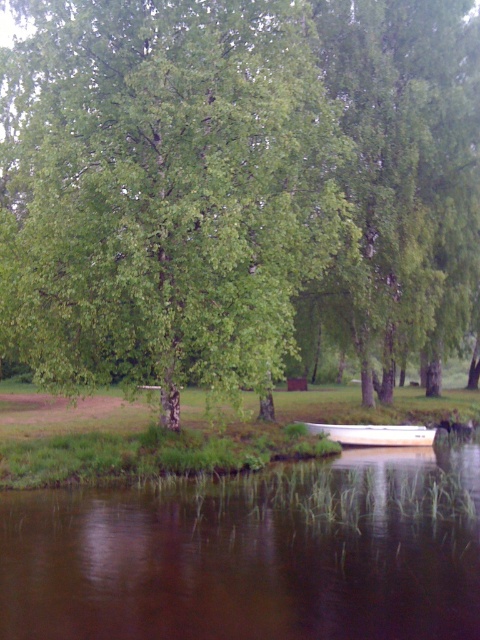
Question: Which of the following is the farthest from the observer?

Choices:
 (A) white plastic boat at lower center
 (B) brown murky water at lower center
 (C) green leafy tree at center

Answer: (A)

Question: Estimate the real-world distances between objects in this image. Which object is farther from the green leafy tree at center?

Choices:
 (A) white plastic boat at lower center
 (B) brown murky water at lower center

Answer: (A)

Question: Considering the real-world distances, which object is closest to the brown murky water at lower center?

Choices:
 (A) green leafy tree at center
 (B) white plastic boat at lower center

Answer: (A)

Question: Does green leafy tree at center have a greater width compared to brown murky water at lower center?

Choices:
 (A) yes
 (B) no

Answer: (A)

Question: Does green leafy tree at center lie behind white plastic boat at lower center?

Choices:
 (A) no
 (B) yes

Answer: (A)

Question: Is green leafy tree at center in front of brown murky water at lower center?

Choices:
 (A) no
 (B) yes

Answer: (A)